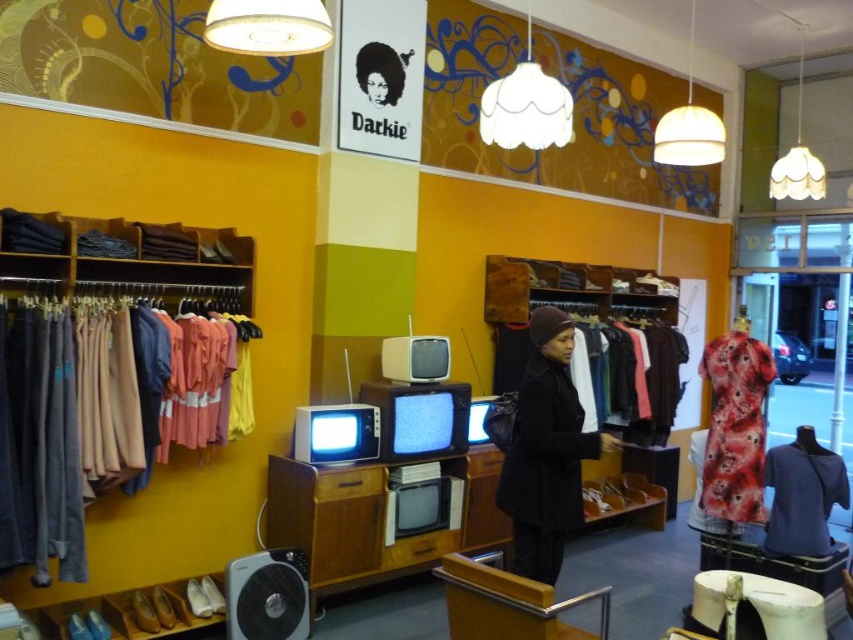
Who is more distant from viewer, (22, 333) or (529, 372)?

The point (529, 372) is behind.

Does point (83, 554) lie behind point (538, 522)?

Yes, point (83, 554) is behind point (538, 522).

I want to click on soft cotton shirts at left, so click(57, 429).

What are the coordinates of `soft cotton shirts at left` in the screenshot? It's located at (57, 429).

Is point (134, 438) positioned after point (403, 72)?

That is False.

Identify the location of soft cotton shirts at left. (57, 429).

Is soft cotton shirts at left behind blue cotton shirt at center?

No.

Where is `soft cotton shirts at left`? Image resolution: width=853 pixels, height=640 pixels. soft cotton shirts at left is located at coordinates (57, 429).

Between point (73, 394) and point (785, 452), which one is positioned behind?

Positioned behind is point (785, 452).

The height and width of the screenshot is (640, 853). I want to click on soft cotton shirts at left, so click(57, 429).